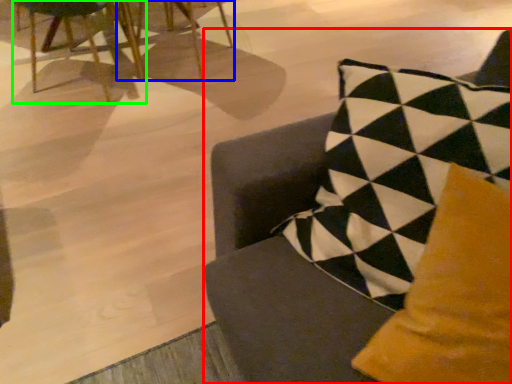
Question: Which object is positioned closest to chair (highlighted by a red box)? Select from chair (highlighted by a blue box) and chair (highlighted by a green box).

Choices:
 (A) chair
 (B) chair

Answer: (B)